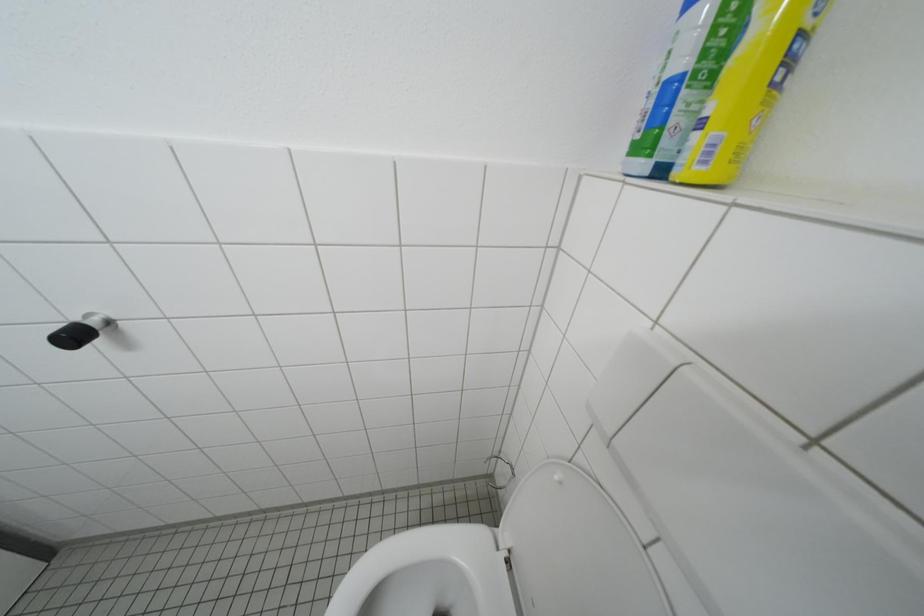
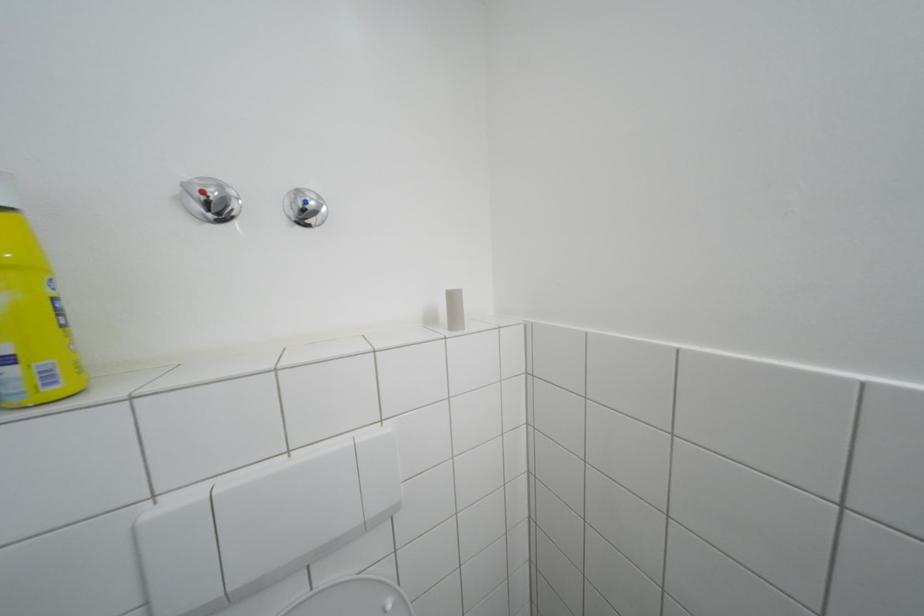
First-person continuous shooting, in which direction is the camera rotating?

The camera rotated toward right-down.